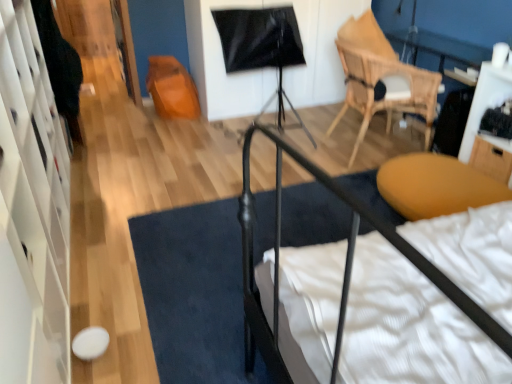
This screenshot has height=384, width=512. What do you see at coordinates (485, 101) in the screenshot?
I see `wooden table at right` at bounding box center [485, 101].

The image size is (512, 384). Find the location of `black fabric doormat at center`. black fabric doormat at center is located at coordinates (195, 292).

You are a GUI agent. You are given a task and a screenshot of the screen. Output one action in this format:
    pyautogui.click(x=<x>, y=<y>)
    Task: Click on the wooden drawer at right
    
    Given the screenshot: What is the action you would take?
    pyautogui.click(x=492, y=158)

Locate an element on the screen. The image size is (512, 384). white glossy dresser at left is located at coordinates (32, 210).

Find the location of `wooden table at right`. wooden table at right is located at coordinates (485, 101).

Who is bigger, wooden table at right or black fabric doormat at center?

black fabric doormat at center is bigger.

Is wooden table at right in contact with black fabric doormat at center?

They are not placed beside each other.

From the image's perspective, which one is positioned lower, wooden table at right or black fabric doormat at center?

From the image's view, black fabric doormat at center is below.

Is wooden table at right outside of black fabric doormat at center?

Yes.

Which object is further away from the camera, wooden drawer at right or wooden table at right?

→ Positioned behind is wooden drawer at right.

From a real-world perspective, does wooden drawer at right stand above wooden table at right?

No, from a real-world perspective, wooden drawer at right is not above wooden table at right.

Based on the photo, from a real-world perspective, is black fabric at left physically located above or below wooden drawer at right?

black fabric at left is above wooden drawer at right.

Is black fabric at left in contact with wooden drawer at right?

No, black fabric at left is not with wooden drawer at right.

This screenshot has width=512, height=384. Identify the location of drawer in front of the black fabric at left. (492, 158).

Is black fabric at left at the left side of wooden drawer at right?

Correct, you'll find black fabric at left to the left of wooden drawer at right.

Find the location of a particular element. Image resolution: width=512 pixels, height=384 pixels. furniture below the black fabric at left (from the image's perspective) is located at coordinates (436, 186).

Is matte yellow ottoman at lower right in front of or behind black fabric at left in the image?

matte yellow ottoman at lower right is in front of black fabric at left.

Based on the photo, from a real-world perspective, is matte yellow ottoman at lower right above or below black fabric at left?

In terms of real-world spatial position, matte yellow ottoman at lower right is below black fabric at left.

Is point (403, 192) positioned after point (76, 99)?

That is False.

Is matte yellow ottoman at lower right not close to wooden drawer at right?

No, matte yellow ottoman at lower right is in close proximity to wooden drawer at right.

Locate an element on the screen. furniture below the wooden drawer at right (from a real-world perspective) is located at coordinates (436, 186).

Who is bigger, matte yellow ottoman at lower right or wooden drawer at right?

matte yellow ottoman at lower right.

Could you tell me if matte yellow ottoman at lower right is facing wooden drawer at right?

No, matte yellow ottoman at lower right is not oriented towards wooden drawer at right.

Is point (499, 72) positioned after point (506, 156)?

No, it is not.

From a real-world perspective, between wooden table at right and wooden drawer at right, who is vertically lower?

wooden drawer at right is physically lower.

Consider the image. Could you tell me if wooden table at right is turned towards wooden drawer at right?

Yes, wooden table at right is turned towards wooden drawer at right.

Considering the sizes of objects wooden table at right and wooden drawer at right in the image provided, who is taller, wooden table at right or wooden drawer at right?

wooden table at right.

Does wooden table at right turn towards white glossy dresser at left?

Yes, wooden table at right faces towards white glossy dresser at left.

Is wooden table at right next to white glossy dresser at left and touching it?

No, wooden table at right is not touching white glossy dresser at left.

Consider the image. From a real-world perspective, between wooden table at right and white glossy dresser at left, who is vertically lower?

wooden table at right, from a real-world perspective.

Can you tell me how much wooden table at right and white glossy dresser at left differ in facing direction?

wooden table at right and white glossy dresser at left are facing 180 degrees away from each other.

You are a GUI agent. You are given a task and a screenshot of the screen. Output one action in this format:
    pyautogui.click(x=<x>, y=<y>)
    Task: Click on the table on the right of black fabric doormat at center
    
    Given the screenshot: What is the action you would take?
    pyautogui.click(x=485, y=101)

Locate an element on the screen. table in front of the wooden drawer at right is located at coordinates (485, 101).

Based on their spatial positions, is wooden table at right or black fabric doormat at center further from matte yellow ottoman at lower right?

Based on the image, black fabric doormat at center appears to be further to matte yellow ottoman at lower right.

From the image, which object appears to be nearer to matte yellow ottoman at lower right, wooden drawer at right or black fabric at left?

wooden drawer at right is positioned closer to the anchor matte yellow ottoman at lower right.

Looking at the image, which one is located further to wooden table at right, wooden drawer at right or black fabric at left?

The object further to wooden table at right is black fabric at left.

When comparing their distances from wooden table at right, does black fabric at left or wooden drawer at right seem further?

The object further to wooden table at right is black fabric at left.

Considering their positions, is white glossy dresser at left positioned further to wooden table at right than matte yellow ottoman at lower right?

The object further to wooden table at right is white glossy dresser at left.

Estimate the real-world distances between objects in this image. Which object is further from white glossy dresser at left, wooden drawer at right or natural wood chair at upper right?

Based on the image, wooden drawer at right appears to be further to white glossy dresser at left.

Considering their positions, is black fabric at left positioned further to wooden table at right than matte yellow ottoman at lower right?

Among the two, black fabric at left is located further to wooden table at right.

From the image, which object appears to be nearer to black fabric doormat at center, matte yellow ottoman at lower right or wooden drawer at right?

The object closer to black fabric doormat at center is matte yellow ottoman at lower right.

Image resolution: width=512 pixels, height=384 pixels. I want to click on furniture located between black fabric doormat at center and natural wood chair at upper right in the depth direction, so click(x=436, y=186).

This screenshot has height=384, width=512. What are the coordinates of `table between black fabric at left and wooden drawer at right in the horizontal direction` in the screenshot? It's located at (485, 101).

Locate an element on the screen. furniture located between black fabric doormat at center and wooden table at right in the left-right direction is located at coordinates (436, 186).

At what (x,y) coordinates should I click in order to perform the action: click on doormat between black fabric at left and wooden drawer at right in the horizontal direction. Please return your answer as a coordinate pair (x, y). Looking at the image, I should click on (195, 292).